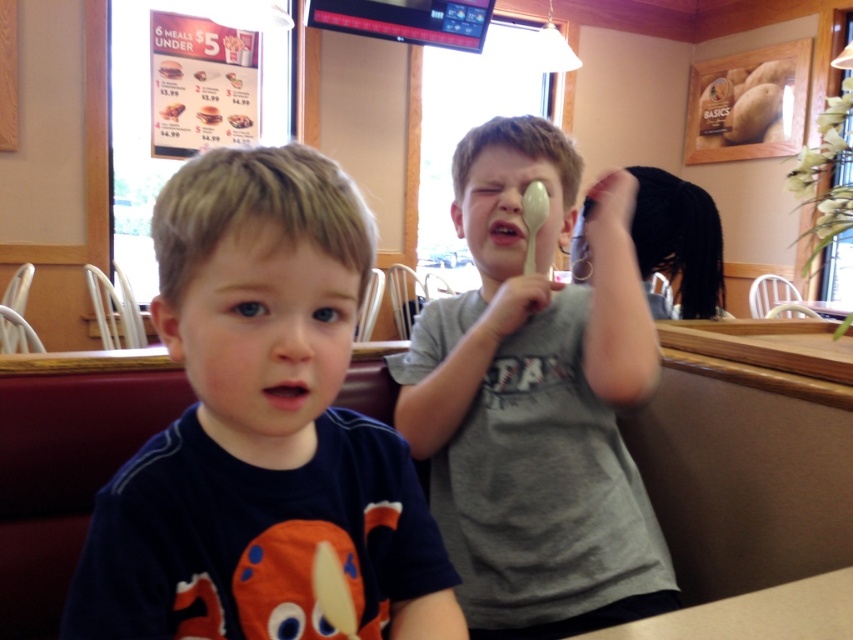
Question: Does dark blue t-shirt at center appear on the left side of white paper menu at upper center?

Choices:
 (A) yes
 (B) no

Answer: (B)

Question: Is golden crispy chicken at upper left smaller than white paper menu at upper center?

Choices:
 (A) yes
 (B) no

Answer: (A)

Question: Estimate the real-world distances between objects in this image. Which object is closer to the matte gray table at lower center?

Choices:
 (A) dark blue t-shirt at center
 (B) gray matte shirt at center

Answer: (A)

Question: Which is nearer to the white paper cup at upper center?

Choices:
 (A) matte cardboard menu at upper center
 (B) dark blue t-shirt at center
 (C) matte cardboard menu at upper left

Answer: (A)

Question: Among these objects, which one is farthest from the camera?

Choices:
 (A) dark blue t-shirt at center
 (B) white paper cup at upper center
 (C) gray matte shirt at center

Answer: (B)

Question: In this image, where is white paper cup at upper center located relative to matte cardboard menu at upper left?

Choices:
 (A) right
 (B) left

Answer: (A)